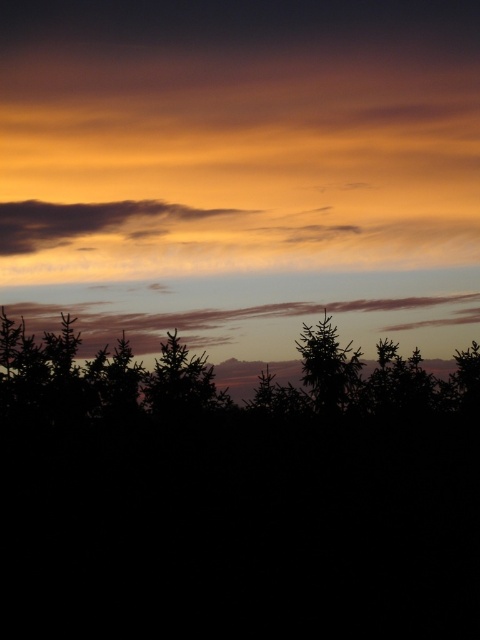
Question: Can you confirm if black silhouetted tree at center is bigger than silhouette tree at center?

Choices:
 (A) no
 (B) yes

Answer: (A)

Question: Which of the following is the closest to the observer?

Choices:
 (A) green matte tree at center
 (B) translucent orange cloud at upper center
 (C) silhouette tree at center

Answer: (A)

Question: Estimate the real-world distances between objects in this image. Which object is closer to the translucent orange cloud at upper center?

Choices:
 (A) black silhouetted tree at center
 (B) silhouette tree at center

Answer: (B)

Question: Considering the relative positions of black silhouetted tree at center and translucent orange cloud at upper center in the image provided, where is black silhouetted tree at center located with respect to translucent orange cloud at upper center?

Choices:
 (A) left
 (B) right

Answer: (B)

Question: Which object appears farthest from the camera in this image?

Choices:
 (A) translucent orange cloud at upper center
 (B) green matte tree at center
 (C) silhouette tree at center

Answer: (A)

Question: Does black silhouetted tree at center come behind green matte tree at center?

Choices:
 (A) no
 (B) yes

Answer: (B)